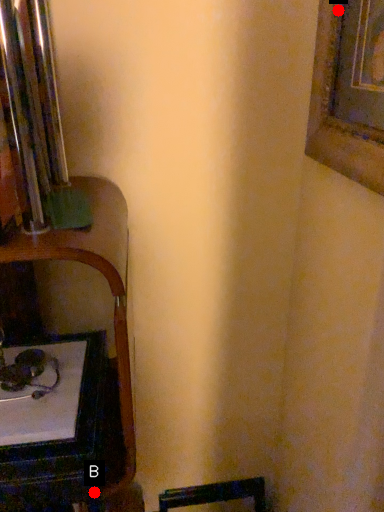
Question: Two points are circled on the image, labeled by A and B beside each circle. Which of the following is the closest to the observer?

Choices:
 (A) A is closer
 (B) B is closer

Answer: (B)